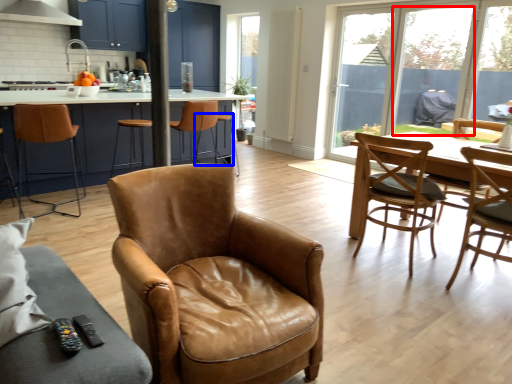
Question: Which of the following is the farthest to the observer, window screen (highlighted by a red box) or bar stool (highlighted by a blue box)?

Choices:
 (A) window screen
 (B) bar stool

Answer: (B)